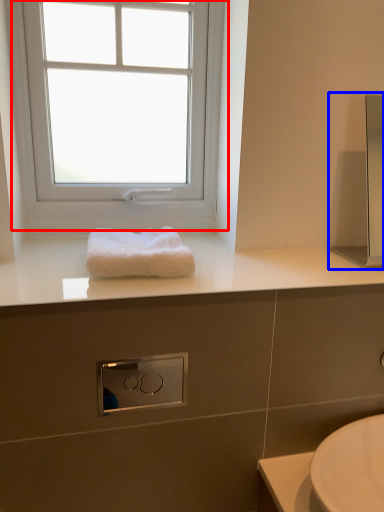
Question: Which object is further to the camera taking this photo, window (highlighted by a red box) or medicine cabinet (highlighted by a blue box)?

Choices:
 (A) window
 (B) medicine cabinet

Answer: (A)